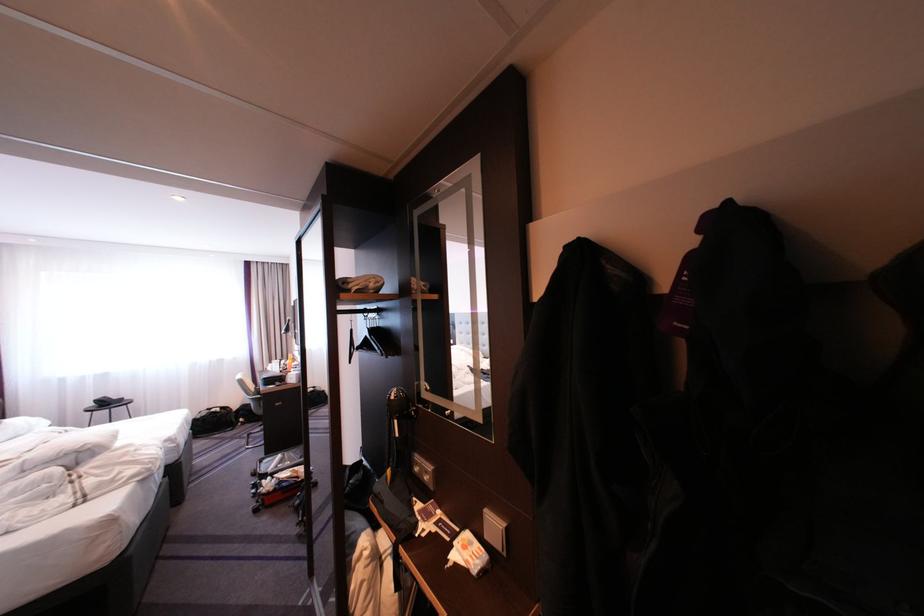
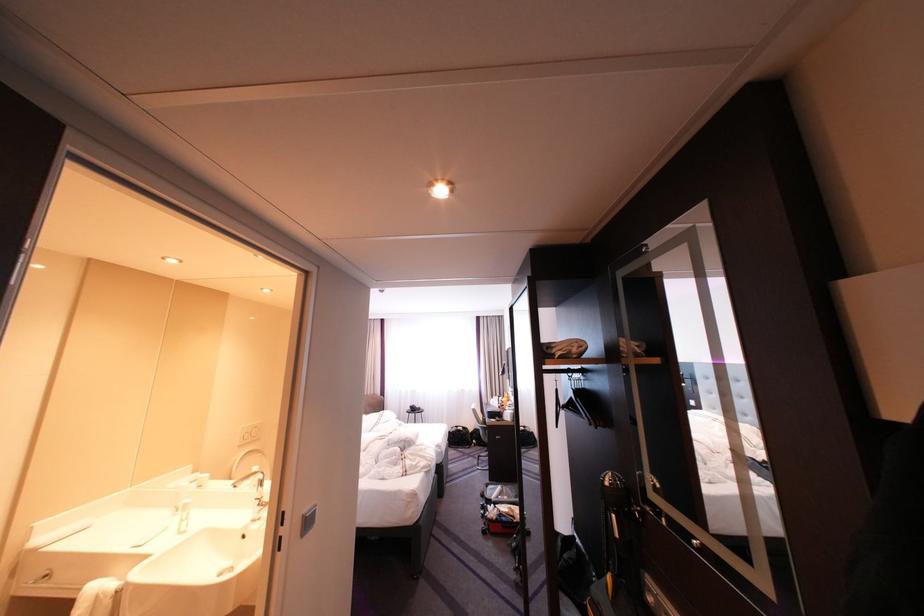
Locate, in the second image, the point that corresponds to point (216, 416) in the first image.

(467, 431)